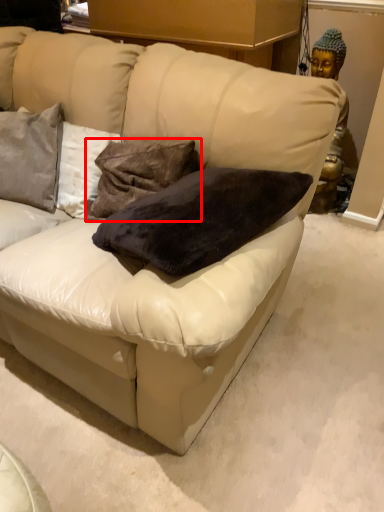
Question: In this image, where is pillow (annotated by the red box) located relative to pillow?

Choices:
 (A) left
 (B) right

Answer: (B)